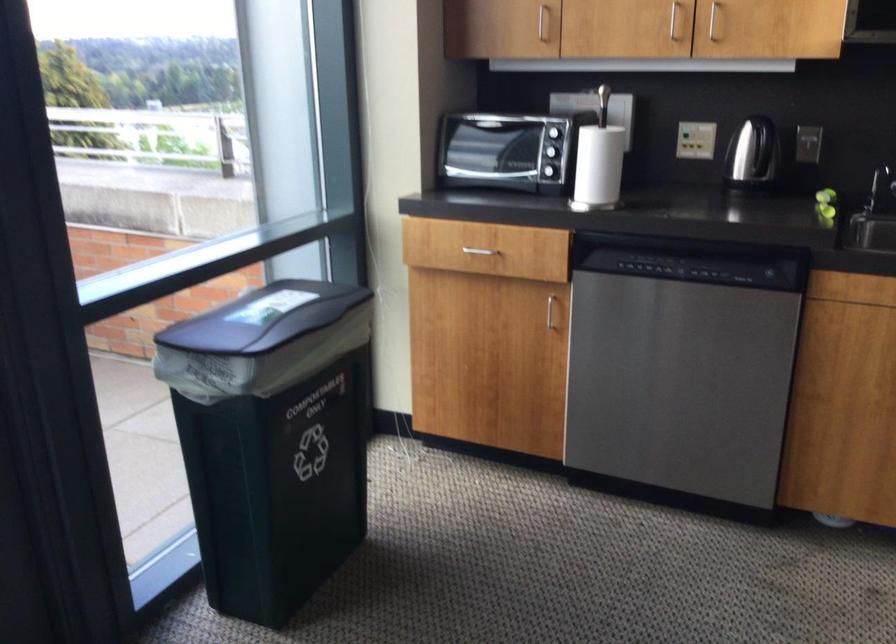
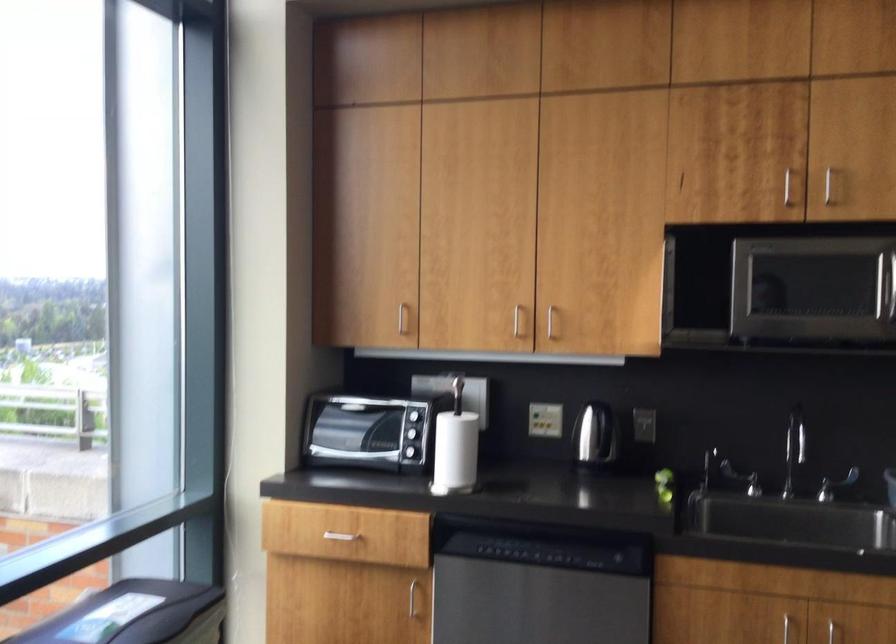
Question: How did the camera likely rotate?

Choices:
 (A) Left
 (B) Right
 (C) Up
 (D) Down

Answer: (C)